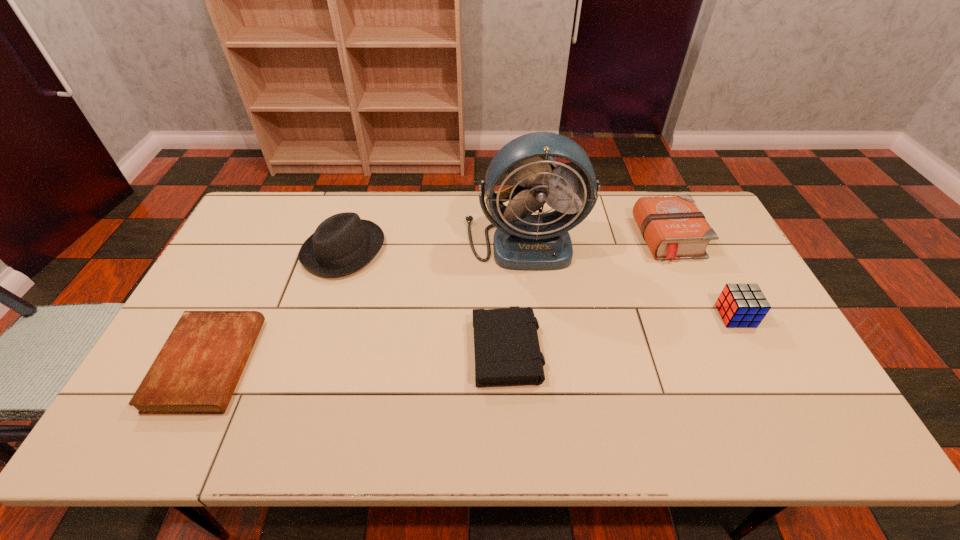
Locate an element on the screen. The height and width of the screenshot is (540, 960). free space that is in between the tallest object and the cube is located at coordinates pyautogui.click(x=630, y=278).

Identify the location of object that is the fifth closest to the rightmost Bible. (198, 368).

At what (x,y) coordinates should I click in order to perform the action: click on the third closest object relative to the fan. Please return your answer as a coordinate pair (x, y). This screenshot has height=540, width=960. Looking at the image, I should click on (343, 243).

I want to click on Bible object that ranks as the closest to the farthest Bible, so click(507, 352).

Identify which Bible is the third nearest to the tallest object. Please provide its 2D coordinates. Your answer should be formatted as a tuple, i.e. [(x, y)], where the tuple contains the x and y coordinates of a point satisfying the conditions above.

[(198, 368)]

Find the location of a particular element. vacant region that satisfies the following two spatial constraints: 1. on the back side of the fedora; 2. on the left side of the tallest Bible is located at coordinates (348, 239).

This screenshot has height=540, width=960. Find the location of `free space that satisfies the following two spatial constraints: 1. in front of the cube to blow air; 2. on the right side of the fan`. free space that satisfies the following two spatial constraints: 1. in front of the cube to blow air; 2. on the right side of the fan is located at coordinates (532, 316).

This screenshot has height=540, width=960. I want to click on free space that satisfies the following two spatial constraints: 1. on the front side of the tallest Bible; 2. on the spine side of the shortest Bible, so click(729, 364).

Find the location of a particular element. free space that satisfies the following two spatial constraints: 1. in front of the tallest object to blow air; 2. on the spine side of the shortest Bible is located at coordinates (537, 364).